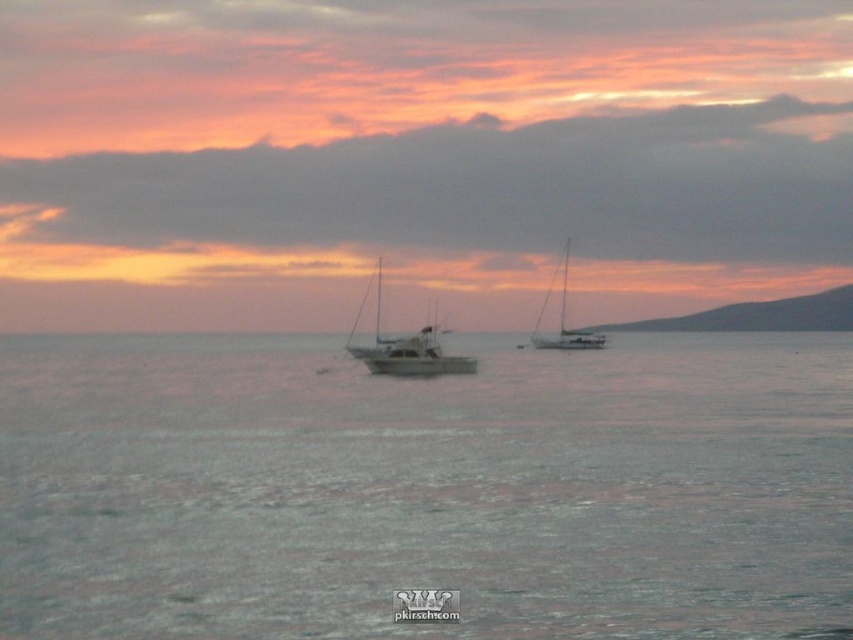
Question: Which of the following is the farthest from the observer?

Choices:
 (A) metallic silver sailboat at center
 (B) gray matte water at center
 (C) white matte sailboat at center

Answer: (A)

Question: Which point is farther to the camera?

Choices:
 (A) white matte sailboat at center
 (B) metallic silver sailboat at center

Answer: (B)

Question: Is white matte sailboat at center above metallic silver sailboat at center?

Choices:
 (A) no
 (B) yes

Answer: (A)

Question: Can you confirm if white matte sailboat at center is thinner than metallic silver sailboat at center?

Choices:
 (A) no
 (B) yes

Answer: (A)

Question: Based on their relative distances, which object is farther from the gray matte water at center?

Choices:
 (A) metallic silver sailboat at center
 (B) white matte sailboat at center

Answer: (A)

Question: Is white matte sailboat at center wider than metallic silver sailboat at center?

Choices:
 (A) yes
 (B) no

Answer: (A)